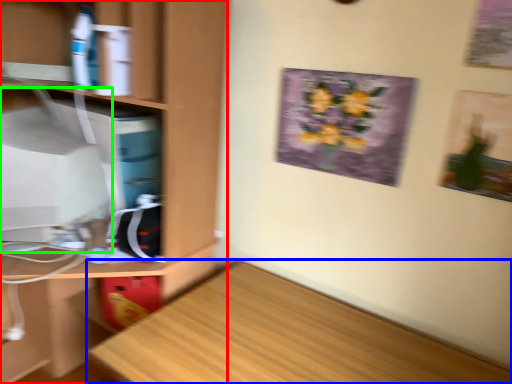
Question: Which object is the farthest from cabinetry (highlighted by a red box)? Choose among these: desk (highlighted by a blue box) or computer monitor (highlighted by a green box).

Choices:
 (A) desk
 (B) computer monitor

Answer: (A)